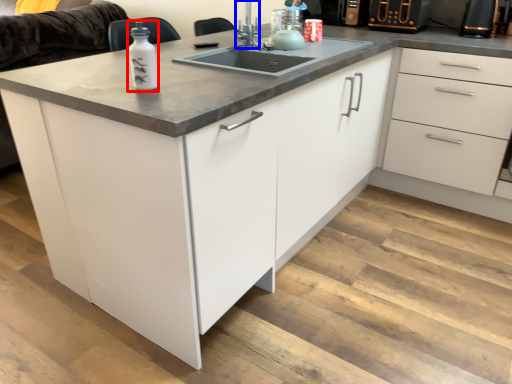
Question: Which object appears closest to the camera in this image, bottle (highlighted by a red box) or faucet (highlighted by a blue box)?

Choices:
 (A) bottle
 (B) faucet

Answer: (A)